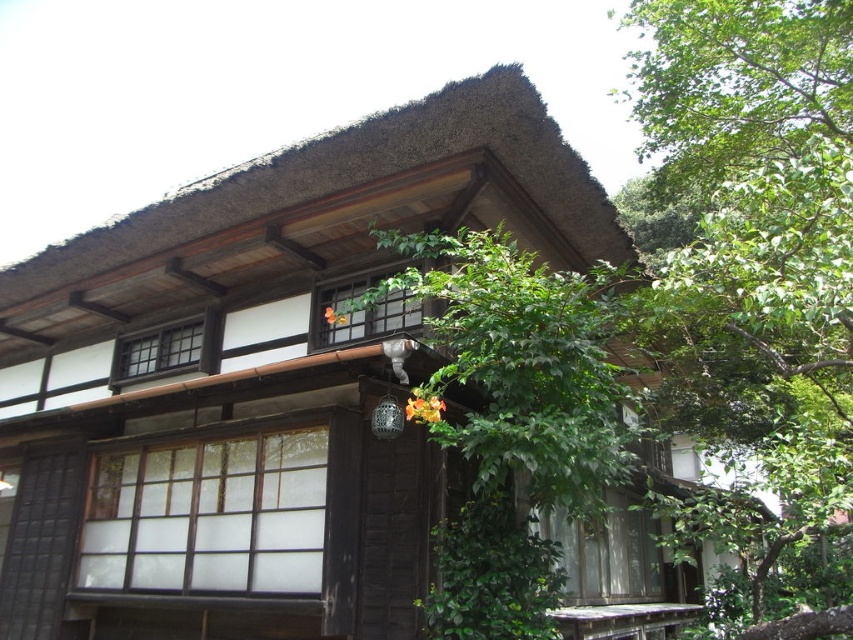
Does brown wooden hut at center have a lesser width compared to green leafy tree at center?

No.

Is brown wooden hut at center wider than green leafy tree at center?

Indeed, brown wooden hut at center has a greater width compared to green leafy tree at center.

Who is more forward, (424, 460) or (369, 292)?

Point (369, 292) is in front.

Where is `brown wooden hut at center`? This screenshot has height=640, width=853. brown wooden hut at center is located at coordinates (257, 380).

Is green leafy tree at upper right positioned in front of green leafy tree at center?

That is True.

Is green leafy tree at upper right to the right of green leafy tree at center from the viewer's perspective?

Indeed, green leafy tree at upper right is positioned on the right side of green leafy tree at center.

Locate an element on the screen. green leafy tree at upper right is located at coordinates (758, 285).

Find the location of `green leafy tree at upper right`. green leafy tree at upper right is located at coordinates (758, 285).

Measure the distance between point (170, 592) and camera.

The distance of point (170, 592) from camera is 26.08 feet.

Can you confirm if brown wooden hut at center is positioned below green leafy tree at upper right?

Correct, brown wooden hut at center is located below green leafy tree at upper right.

Does point (253, 428) come in front of point (793, 515)?

No, it is not.

Identify the location of brown wooden hut at center. (257, 380).